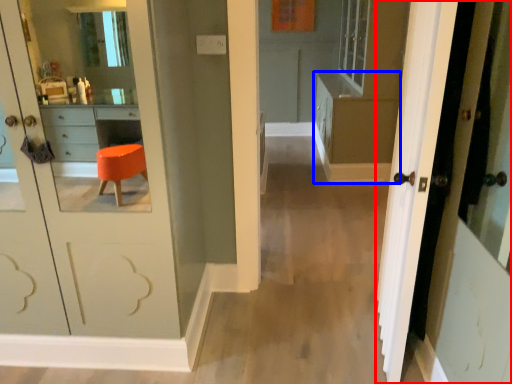
Question: Which of the following is the farthest to the observer, door (highlighted by a red box) or dresser (highlighted by a blue box)?

Choices:
 (A) door
 (B) dresser

Answer: (B)